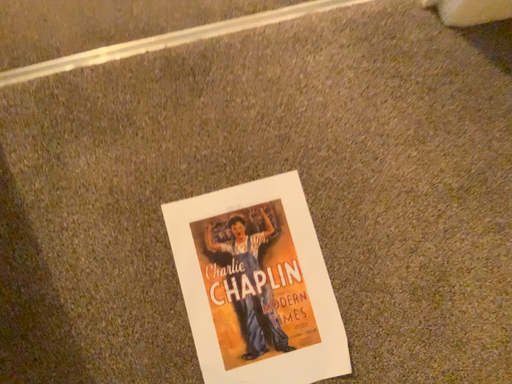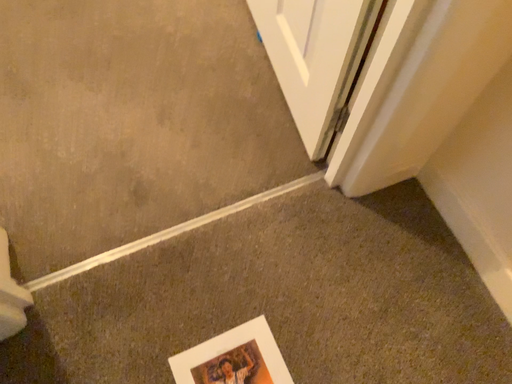
Question: How did the camera likely rotate when shooting the video?

Choices:
 (A) rotated upward
 (B) rotated downward

Answer: (A)